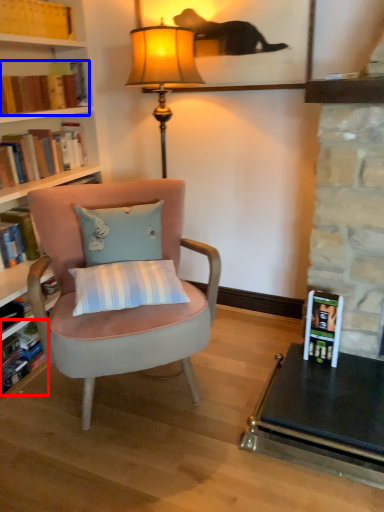
Question: Which point is closer to the camera, book (highlighted by a red box) or book (highlighted by a blue box)?

Choices:
 (A) book
 (B) book

Answer: (A)